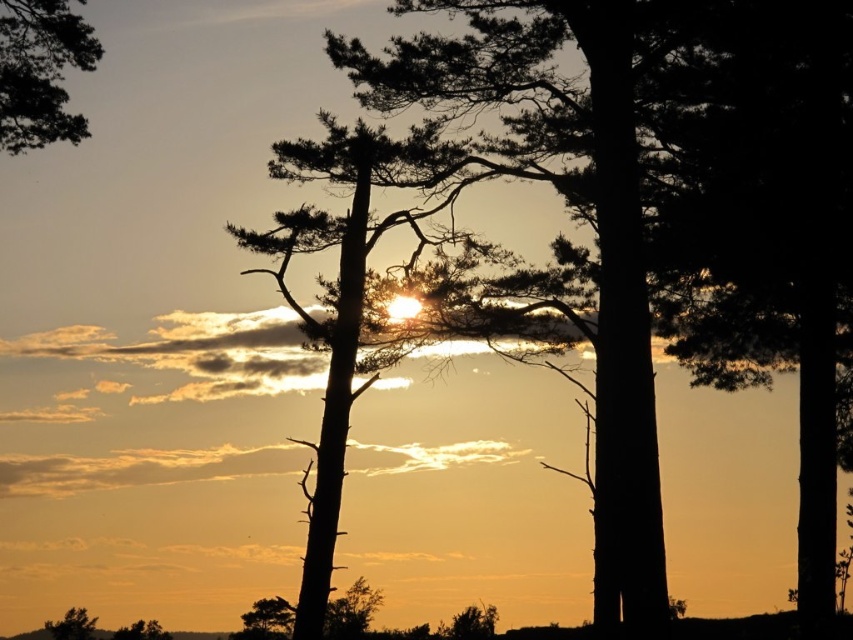
Is silvery bark tree at lower left positioned behind green matte tree at lower left?

Yes.

Who is positioned more to the right, silvery bark tree at lower left or green matte tree at lower left?

Positioned to the right is green matte tree at lower left.

Where is `silvery bark tree at lower left`? Image resolution: width=853 pixels, height=640 pixels. silvery bark tree at lower left is located at coordinates (73, 625).

Between silhouette pine tree at upper left and silvery bark tree at lower left, which one is positioned lower?

silvery bark tree at lower left

Measure the distance between point (7, 22) and camera.

The distance of point (7, 22) from camera is 114.31 feet.

Locate an element on the screen. This screenshot has height=640, width=853. silhouette pine tree at upper left is located at coordinates (39, 72).

Between silhouette pine tree at upper left and green matte tree at lower left, which one is positioned higher?

Positioned higher is silhouette pine tree at upper left.

Is silhouette pine tree at upper left to the left of green matte tree at lower left from the viewer's perspective?

In fact, silhouette pine tree at upper left is to the right of green matte tree at lower left.

Is point (15, 150) positioned in front of point (149, 637)?

Yes.

Identify the location of silhouette pine tree at upper left. Image resolution: width=853 pixels, height=640 pixels. (39, 72).